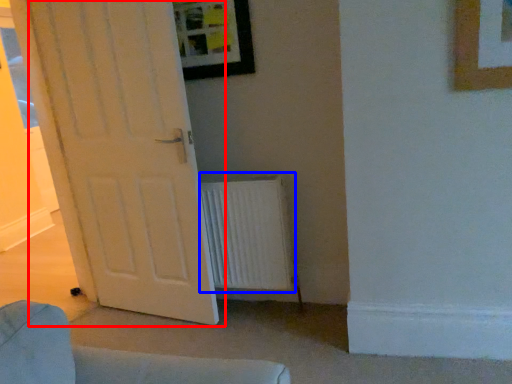
Question: Which of the following is the farthest to the observer, door (highlighted by a red box) or radiator (highlighted by a blue box)?

Choices:
 (A) door
 (B) radiator

Answer: (B)